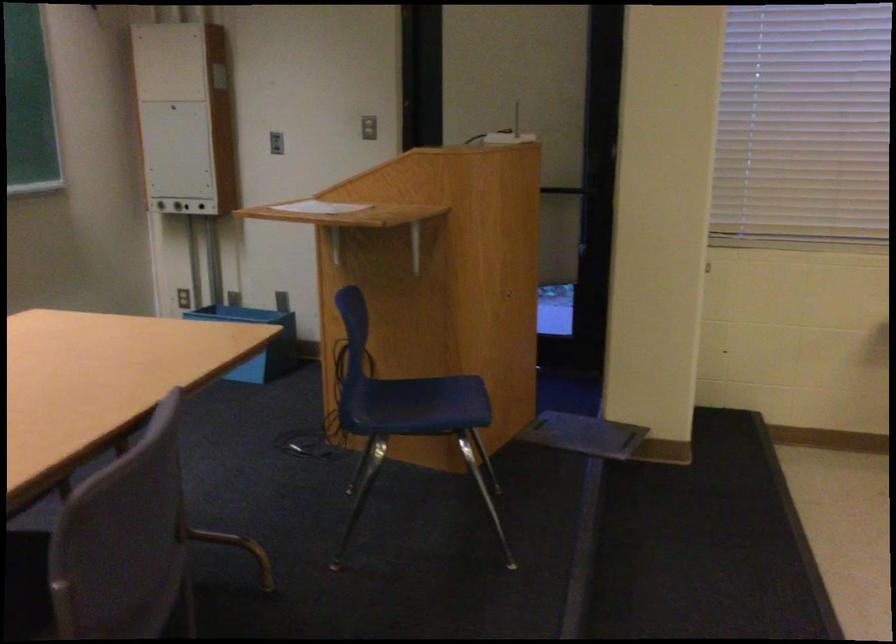
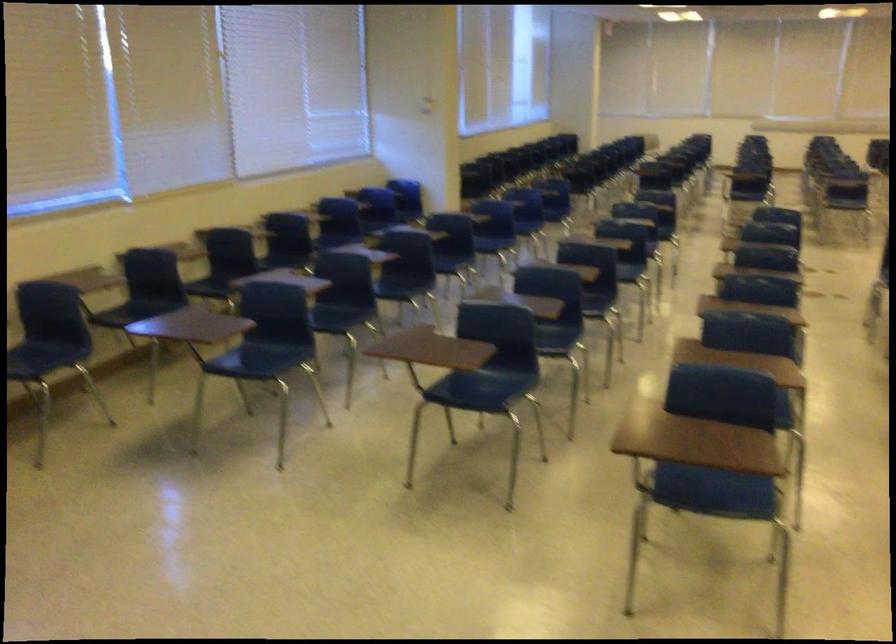
How did the camera likely rotate?

The camera rotated toward right-down.